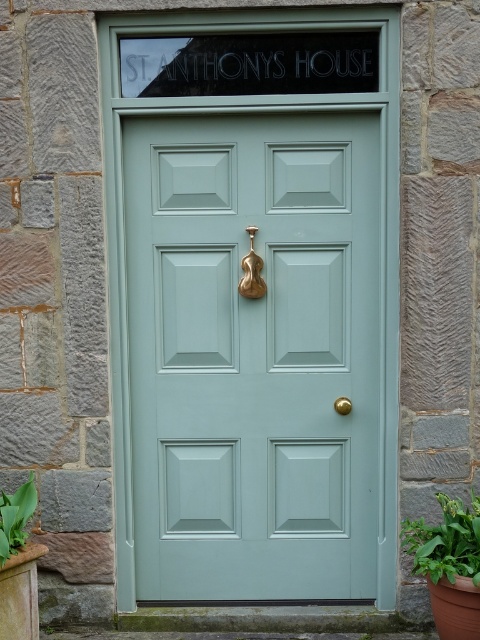
Between satin teal door at center and gold metallic door handle at center, which one has more height?

With more height is satin teal door at center.

Which is more to the left, satin teal door at center or gold metallic door handle at center?

From the viewer's perspective, satin teal door at center appears more on the left side.

Measure the distance between satin teal door at center and camera.

satin teal door at center and camera are 3.93 meters apart from each other.

This screenshot has height=640, width=480. In order to click on satin teal door at center in this screenshot , I will do `click(254, 355)`.

Is green leafy plant at lower right thinner than green leafy plant at lower left?

Incorrect, green leafy plant at lower right's width is not less than green leafy plant at lower left's.

Based on the photo, is green leafy plant at lower right taller than green leafy plant at lower left?

Yes.

The width and height of the screenshot is (480, 640). Find the location of `green leafy plant at lower right`. green leafy plant at lower right is located at coordinates (445, 541).

Can you confirm if green leafy plant at lower left is shorter than gold metallic door handle at center?

No, green leafy plant at lower left is not shorter than gold metallic door handle at center.

Based on the photo, does green leafy plant at lower left appear on the left side of gold metallic door handle at center?

Correct, you'll find green leafy plant at lower left to the left of gold metallic door handle at center.

Which is in front, point (12, 509) or point (336, 408)?

Point (12, 509) is more forward.

The height and width of the screenshot is (640, 480). I want to click on green leafy plant at lower left, so click(x=15, y=518).